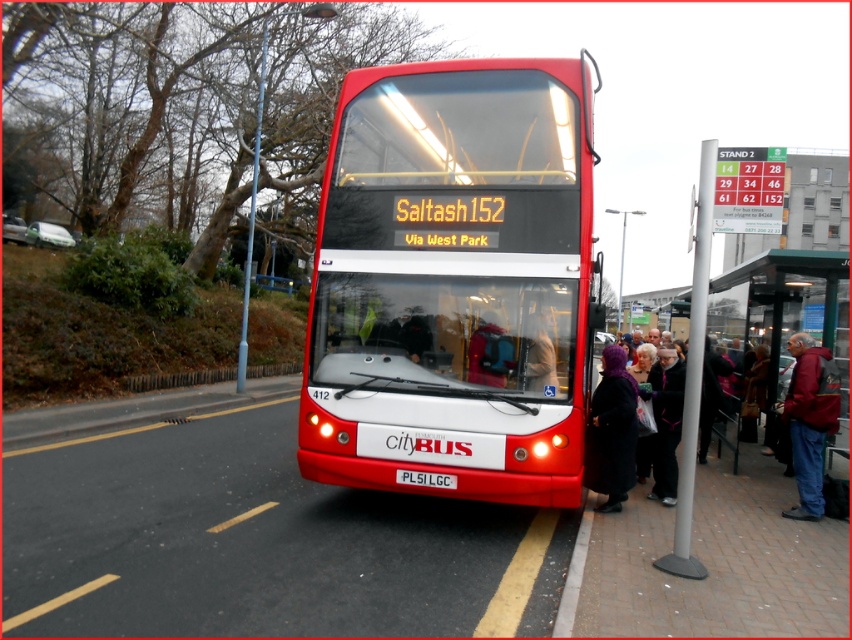
The width and height of the screenshot is (852, 640). What do you see at coordinates (453, 282) in the screenshot?
I see `shiny red bus at center` at bounding box center [453, 282].

Is point (528, 467) behind point (626, 404)?

No.

Who is more forward, [481,193] or [625,456]?

Point [481,193] is in front.

Locate an element on the screen. shiny red bus at center is located at coordinates (453, 282).

Which of these two, metallic pole at center right or red leather jacket at lower right, stands shorter?

Standing shorter between the two is red leather jacket at lower right.

Does metallic pole at center right have a larger size compared to red leather jacket at lower right?

Correct, metallic pole at center right is larger in size than red leather jacket at lower right.

What do you see at coordinates (694, 369) in the screenshot? The width and height of the screenshot is (852, 640). I see `metallic pole at center right` at bounding box center [694, 369].

In order to click on metallic pole at center right in this screenshot , I will do `click(694, 369)`.

Does dark purple knit hat at lower right come behind white plastic license plate at center?

Yes, dark purple knit hat at lower right is further from the viewer.

In the scene shown: Is dark purple knit hat at lower right bigger than white plastic license plate at center?

Yes.

This screenshot has height=640, width=852. Find the location of `dark purple knit hat at lower right`. dark purple knit hat at lower right is located at coordinates (665, 429).